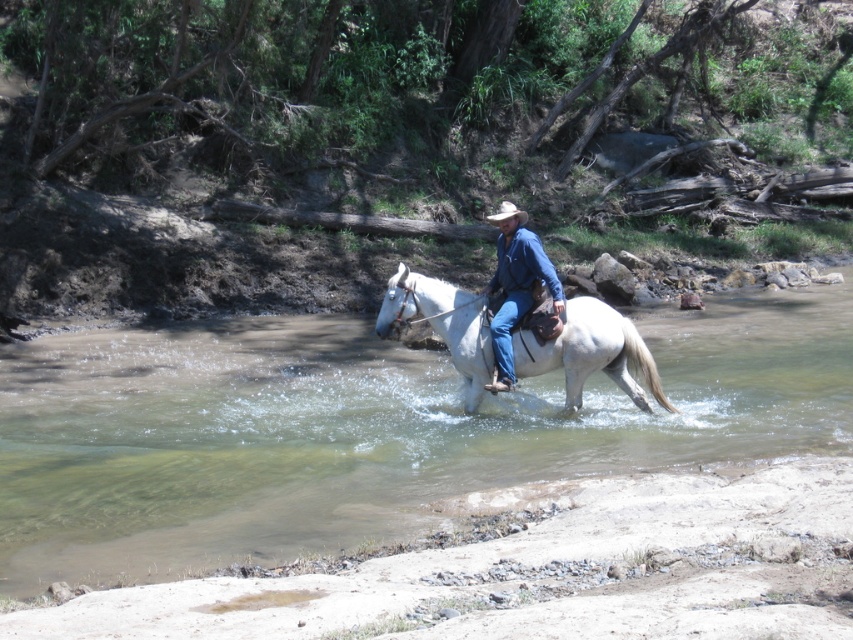
Question: Estimate the real-world distances between objects in this image. Which object is farther from the white glossy horse at center?

Choices:
 (A) clear water at horse center
 (B) light brown felt cowboy hat at center
 (C) blue denim jeans at center

Answer: (A)

Question: Is clear water at horse center above light brown felt cowboy hat at center?

Choices:
 (A) yes
 (B) no

Answer: (B)

Question: Which point is closer to the camera?

Choices:
 (A) white glossy horse at center
 (B) light brown felt cowboy hat at center
 (C) blue denim jeans at center

Answer: (A)

Question: Which point is farther to the camera?

Choices:
 (A) (593, 364)
 (B) (519, 282)
 (C) (756, 419)

Answer: (C)

Question: Is clear water at horse center to the right of white glossy horse at center from the viewer's perspective?

Choices:
 (A) no
 (B) yes

Answer: (B)

Question: Does clear water at horse center lie in front of white glossy horse at center?

Choices:
 (A) no
 (B) yes

Answer: (B)